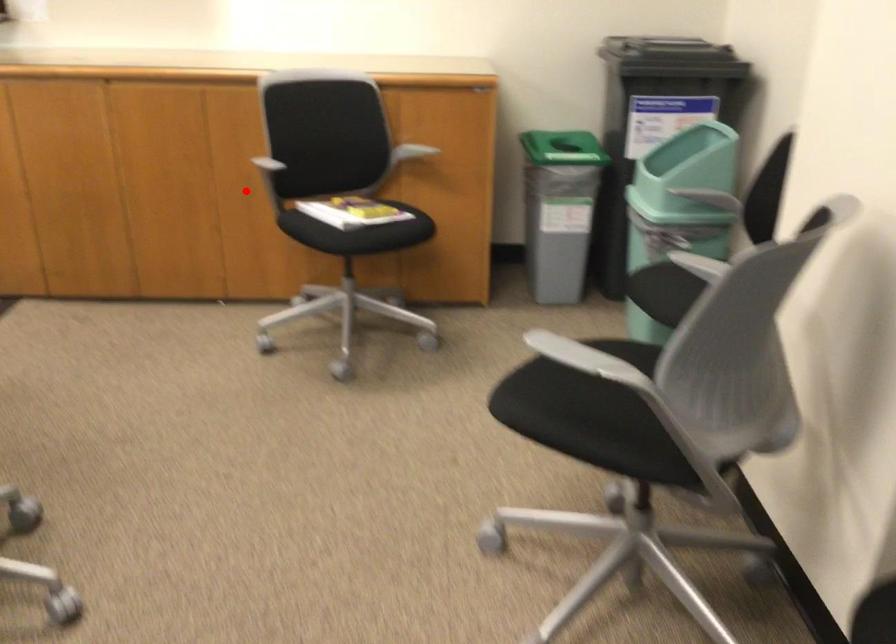
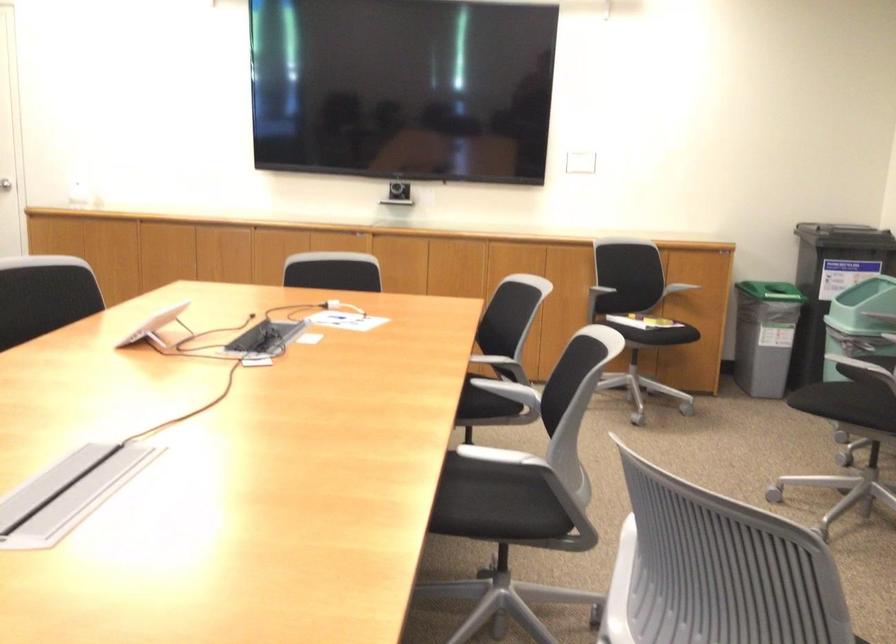
Locate, in the second image, the point that corresponds to the highlighted location in the first image.

(571, 290)